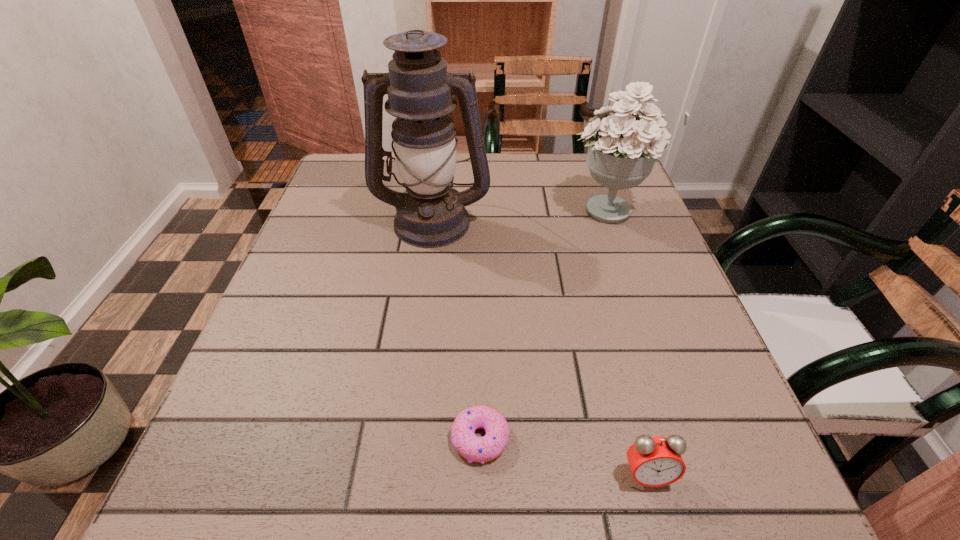
In the image, there is a desktop. Identify the location of free space at the right edge. This screenshot has height=540, width=960. (612, 235).

Where is `vacant region at the far left corner of the desktop`? vacant region at the far left corner of the desktop is located at coordinates point(328,199).

Image resolution: width=960 pixels, height=540 pixels. Find the location of `vacant position at the far right corner of the desktop`. vacant position at the far right corner of the desktop is located at coordinates (573, 167).

The width and height of the screenshot is (960, 540). What are the coordinates of `free point between the oil lamp and the bouquet` in the screenshot? It's located at (519, 215).

The width and height of the screenshot is (960, 540). What are the coordinates of `vacant area between the alarm clock and the tallest object` in the screenshot? It's located at click(x=540, y=348).

This screenshot has width=960, height=540. I want to click on free point between the third tallest object and the bouquet, so click(x=627, y=342).

Where is `vacant area that lies between the oil lamp and the doughnut`? The width and height of the screenshot is (960, 540). vacant area that lies between the oil lamp and the doughnut is located at coordinates (456, 329).

Find the location of a particular element. free space between the alarm clock and the tallest object is located at coordinates (540, 348).

Locate an element on the screen. The image size is (960, 540). empty space that is in between the alarm clock and the bouquet is located at coordinates (x=627, y=342).

The height and width of the screenshot is (540, 960). I want to click on unoccupied area between the second shortest object and the bouquet, so click(x=627, y=342).